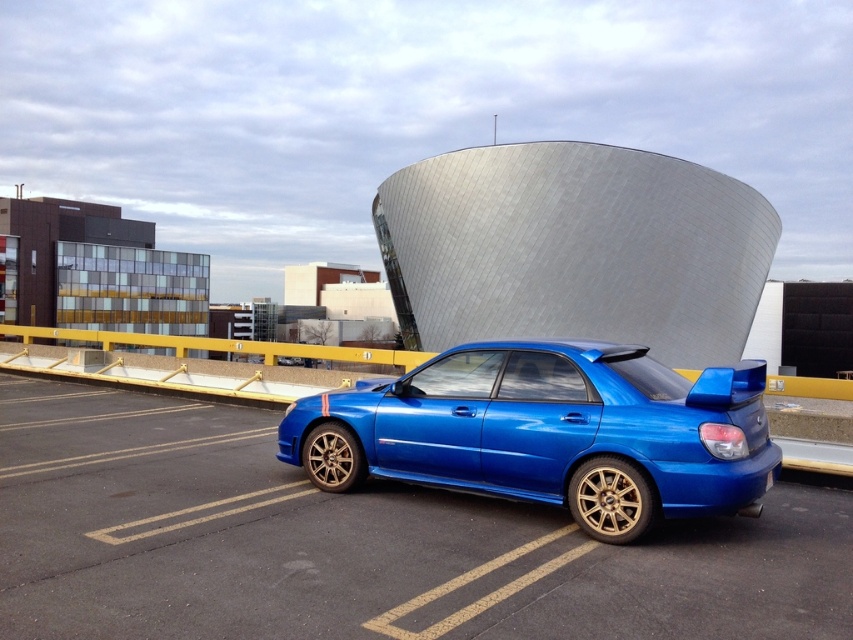
Question: Which point appears closest to the camera in this image?

Choices:
 (A) (683, 387)
 (B) (260, 486)

Answer: (A)

Question: Among these objects, which one is nearest to the camera?

Choices:
 (A) metallic blue car at center
 (B) glossy blue car at center

Answer: (A)

Question: Does metallic blue car at center have a greater width compared to glossy blue car at center?

Choices:
 (A) yes
 (B) no

Answer: (A)

Question: Can you confirm if metallic blue car at center is smaller than glossy blue car at center?

Choices:
 (A) no
 (B) yes

Answer: (B)

Question: Which point appears farthest from the camera in this image?

Choices:
 (A) (236, 586)
 (B) (560, 456)

Answer: (B)

Question: Is metallic blue car at center positioned before glossy blue car at center?

Choices:
 (A) no
 (B) yes

Answer: (B)